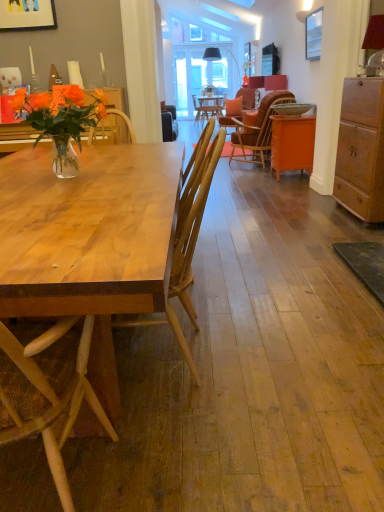
Question: Is matte white coffee cup at upper left further to the viewer compared to metallic silver picture frame at upper right, marked as the first picture frame in a right-to-left arrangement?

Choices:
 (A) yes
 (B) no

Answer: (B)

Question: From a real-world perspective, is matte white coffee cup at upper left under metallic silver picture frame at upper right, the second picture frame when ordered from left to right?

Choices:
 (A) yes
 (B) no

Answer: (A)

Question: Is matte white coffee cup at upper left completely or partially outside of metallic silver picture frame at upper right, the second picture frame when ordered from left to right?

Choices:
 (A) yes
 (B) no

Answer: (A)

Question: Considering the relative sizes of matte white coffee cup at upper left and metallic silver picture frame at upper right, positioned as the 1th picture frame in back-to-front order, in the image provided, is matte white coffee cup at upper left wider than metallic silver picture frame at upper right, positioned as the 1th picture frame in back-to-front order,?

Choices:
 (A) no
 (B) yes

Answer: (B)

Question: Does matte white coffee cup at upper left have a larger size compared to metallic silver picture frame at upper right, positioned as the 1th picture frame in back-to-front order?

Choices:
 (A) no
 (B) yes

Answer: (A)

Question: From the image's perspective, is wooden chair at center, acting as the 1th chair starting from the left, located above or below orange matte cabinet at right, marked as the 1th cabinetry in a back-to-front arrangement?

Choices:
 (A) above
 (B) below

Answer: (B)

Question: Do you think wooden chair at center, acting as the 1th chair starting from the left, is within orange matte cabinet at right, marked as the 1th cabinetry in a back-to-front arrangement, or outside of it?

Choices:
 (A) outside
 (B) inside

Answer: (A)

Question: Based on their positions, is wooden chair at center, which appears as the second chair when viewed from the right, located to the left or right of orange matte cabinet at right, marked as the 1th cabinetry in a back-to-front arrangement?

Choices:
 (A) left
 (B) right

Answer: (A)

Question: Looking at their shapes, would you say wooden chair at center, arranged as the 2th chair when viewed from the top, is wider or thinner than orange matte cabinet at right, marked as the 1th cabinetry in a back-to-front arrangement?

Choices:
 (A) wide
 (B) thin

Answer: (A)

Question: In the image, is orange fabric chair at center, the second chair in the front-to-back sequence, positioned in front of or behind wooden chair at center, the first chair when ordered from front to back?

Choices:
 (A) behind
 (B) front

Answer: (A)

Question: Considering the positions of point (266, 129) and point (168, 309), is point (266, 129) closer or farther from the camera than point (168, 309)?

Choices:
 (A) closer
 (B) farther

Answer: (B)

Question: Is orange fabric chair at center, the 1th chair when ordered from back to front, inside or outside of wooden chair at center, the first chair when ordered from front to back?

Choices:
 (A) outside
 (B) inside

Answer: (A)

Question: In terms of height, does orange fabric chair at center, which is the second chair from left to right, look taller or shorter compared to wooden chair at center, arranged as the 2th chair when viewed from the top?

Choices:
 (A) short
 (B) tall

Answer: (B)

Question: Based on their positions, is wooden cabinet at right, the 1th cabinetry when ordered from front to back, located to the left or right of metallic silver picture frame at upper right, which ranks as the 2th picture frame in front-to-back order?

Choices:
 (A) left
 (B) right

Answer: (B)

Question: In terms of height, does wooden cabinet at right, the 1th cabinetry when ordered from front to back, look taller or shorter compared to metallic silver picture frame at upper right, positioned as the 1th picture frame in back-to-front order?

Choices:
 (A) short
 (B) tall

Answer: (B)